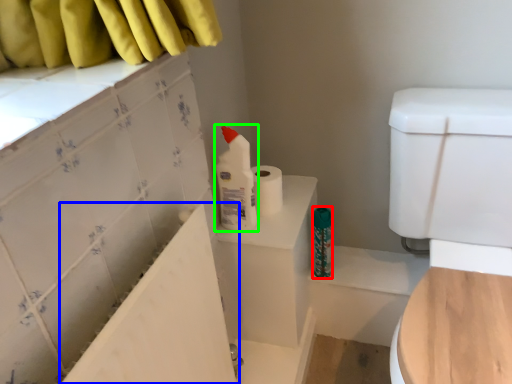
Question: Which is nearer to the toiletry (highlighted by a red box)? bath (highlighted by a blue box) or cleaning product (highlighted by a green box).

Choices:
 (A) bath
 (B) cleaning product

Answer: (B)